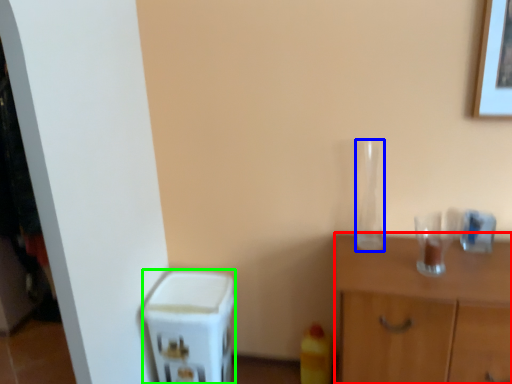
Question: Based on their relative distances, which object is farther from nightstand (highlighted by a red box)? Choose from glass vase (highlighted by a blue box) and appliance (highlighted by a green box).

Choices:
 (A) glass vase
 (B) appliance

Answer: (B)